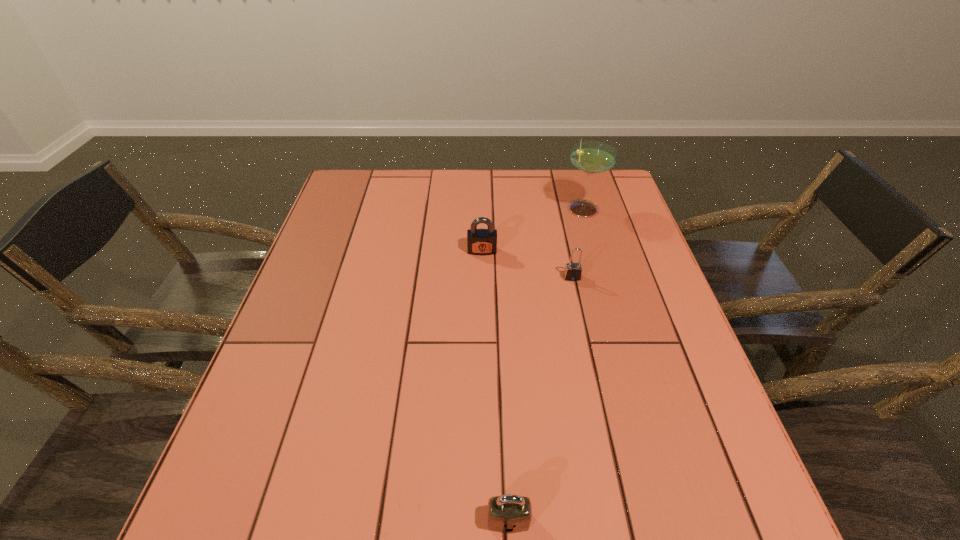
Locate an element on the screen. object at the near edge is located at coordinates (510, 513).

You are a GUI agent. You are given a task and a screenshot of the screen. Output one action in this format:
    pyautogui.click(x=<x>, y=<y>)
    Task: Click on the object that is positioned at the right edge
    The height and width of the screenshot is (540, 960).
    Given the screenshot: What is the action you would take?
    pyautogui.click(x=591, y=157)

Where is `object that is at the far right corner`? This screenshot has width=960, height=540. object that is at the far right corner is located at coordinates (591, 157).

You are a GUI agent. You are given a task and a screenshot of the screen. Output one action in this format:
    pyautogui.click(x=<x>, y=<y>)
    Task: Click on the vacant space at the far edge
    The width and height of the screenshot is (960, 540).
    Given the screenshot: What is the action you would take?
    pyautogui.click(x=491, y=174)

Locate an element on the screen. The width and height of the screenshot is (960, 540). free region at the left edge of the desktop is located at coordinates (291, 434).

You are a GUI agent. You are given a task and a screenshot of the screen. Output one action in this format:
    pyautogui.click(x=<x>, y=<y>)
    Task: Click on the free space at the right edge of the desktop
    Image resolution: width=960 pixels, height=540 pixels.
    Given the screenshot: What is the action you would take?
    pyautogui.click(x=652, y=315)

At what (x,y) coordinates should I click in order to perform the action: click on vacant point at the far left corner. Please return your answer as a coordinate pair (x, y). The height and width of the screenshot is (540, 960). Looking at the image, I should click on (372, 189).

Image resolution: width=960 pixels, height=540 pixels. In order to click on free space between the second farthest padlock and the martini in this screenshot , I will do `click(577, 242)`.

Find the location of a particular element. This screenshot has height=540, width=960. empty location between the third nearest object and the nearest padlock is located at coordinates (495, 386).

Locate an element on the screen. The image size is (960, 540). vacant area between the second farthest padlock and the nearest padlock is located at coordinates (540, 399).